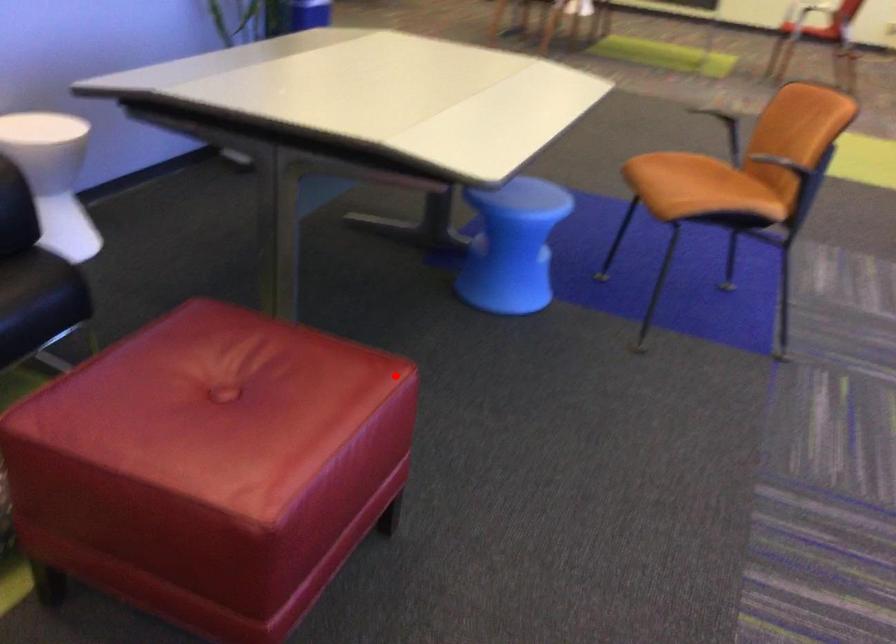
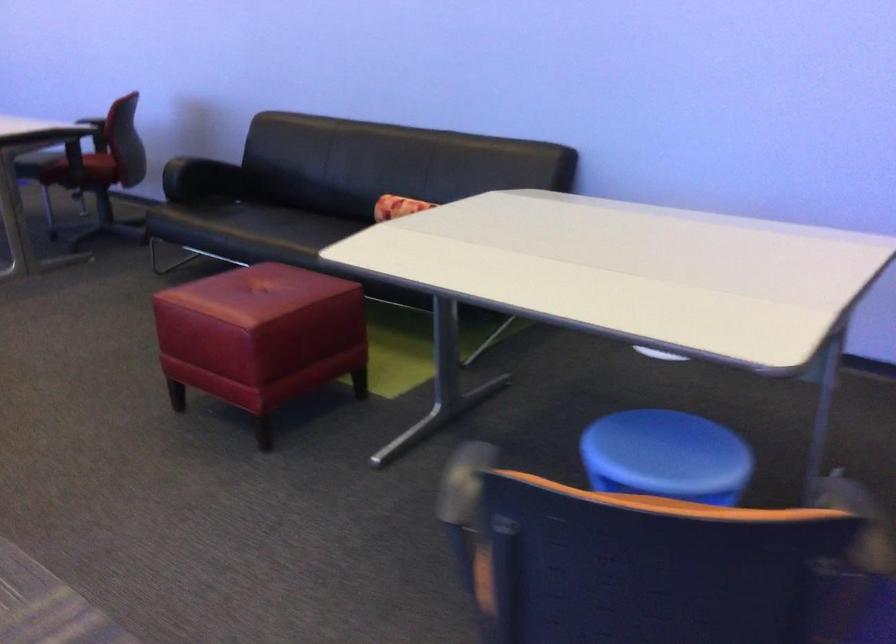
Locate, in the second image, the point that corresponds to the highlighted location in the first image.

(261, 337)